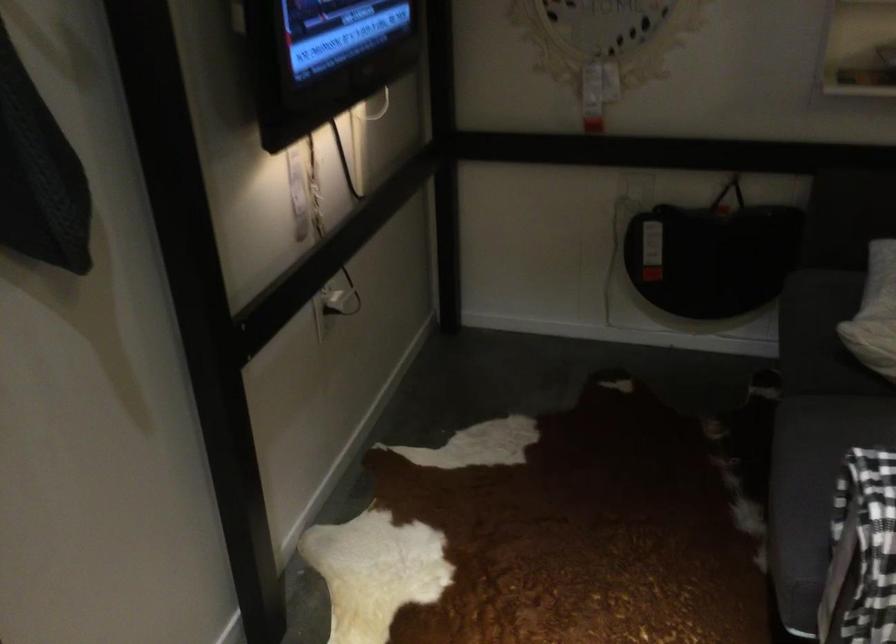
Where would you lift the white pillow? Please return your answer as a coordinate pair (x, y).

(874, 313)